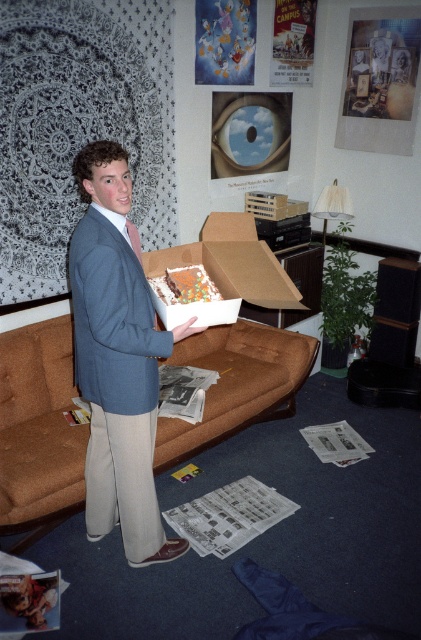
You are standing in the living room and want to place the chocolate frosted cake at center on the brown fabric couch at center. Can you place it directly in front of you without moving either object?

The brown fabric couch at center is further to the viewer than the chocolate frosted cake at center, so placing the cake directly in front of you on the couch would require moving the cake forward to align with the couch since the couch is closer to you.

You are a photographer standing in the living room and want to take a photo of the matte blue blazer at center and the chocolate frosted cake at center. Which object should you focus on first to ensure both are in sharp focus?

You should focus on the matte blue blazer at center first because it is closer to the viewer than the chocolate frosted cake at center, so adjusting focus from near to far will help both objects be in sharp focus.

You are standing in the living room and want to place a new rug on the floor. The current carpet is dark blue. Where should you place the rug so that it is near the brown fabric couch at center?

You should place the rug near the brown fabric couch at center, which is located at point 0.673 on the x axis and 0.093 on the y axis.